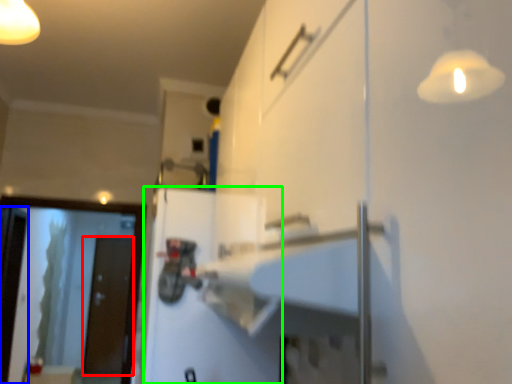
Question: Based on their relative distances, which object is nearer to door (highlighted by a red box)? Choose from screen door (highlighted by a blue box) and door (highlighted by a green box).

Choices:
 (A) screen door
 (B) door

Answer: (A)